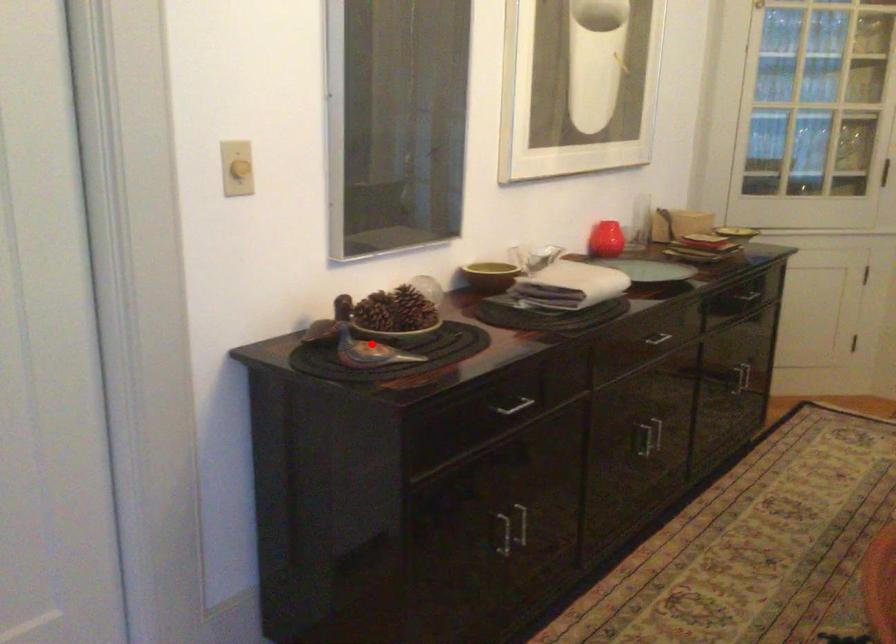
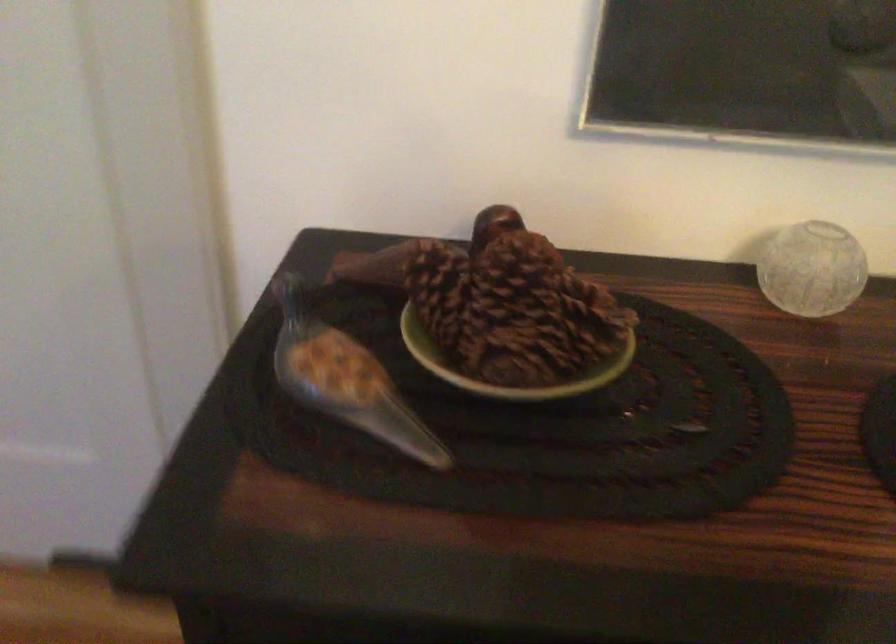
Find the pixel in the second image that matches the highlighted location in the first image.

(347, 386)